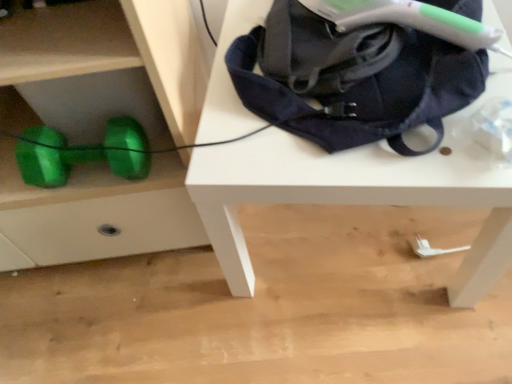
Question: Could you tell me if green shiny dumbbell at lower left is facing navy blue fabric bag at upper right?

Choices:
 (A) yes
 (B) no

Answer: (B)

Question: Is navy blue fabric bag at upper right inside green shiny dumbbell at lower left?

Choices:
 (A) no
 (B) yes

Answer: (A)

Question: Does green shiny dumbbell at lower left have a larger size compared to navy blue fabric bag at upper right?

Choices:
 (A) no
 (B) yes

Answer: (B)

Question: From a real-world perspective, is green shiny dumbbell at lower left positioned under navy blue fabric bag at upper right based on gravity?

Choices:
 (A) no
 (B) yes

Answer: (B)

Question: Is green shiny dumbbell at lower left not close to navy blue fabric bag at upper right?

Choices:
 (A) no
 (B) yes

Answer: (A)

Question: From the image's perspective, is green shiny dumbbell at lower left under navy blue fabric bag at upper right?

Choices:
 (A) yes
 (B) no

Answer: (A)

Question: Is the position of white matte table at upper center more distant than that of green metallic dumbbell at lower left?

Choices:
 (A) yes
 (B) no

Answer: (B)

Question: From a real-world perspective, is white matte table at upper center on green metallic dumbbell at lower left?

Choices:
 (A) yes
 (B) no

Answer: (B)

Question: Can you confirm if white matte table at upper center is positioned to the right of green metallic dumbbell at lower left?

Choices:
 (A) yes
 (B) no

Answer: (A)

Question: Is white matte table at upper center outside of green metallic dumbbell at lower left?

Choices:
 (A) yes
 (B) no

Answer: (A)

Question: From a real-world perspective, is white matte table at upper center below green metallic dumbbell at lower left?

Choices:
 (A) yes
 (B) no

Answer: (A)

Question: Can you confirm if white matte table at upper center is wider than green metallic dumbbell at lower left?

Choices:
 (A) no
 (B) yes

Answer: (B)

Question: From a real-world perspective, is navy blue fabric bag at upper right below white matte table at upper center?

Choices:
 (A) yes
 (B) no

Answer: (B)